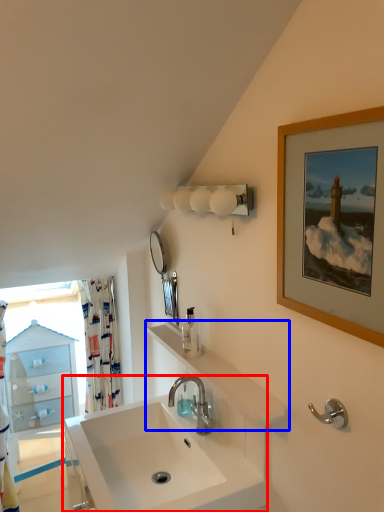
Question: Which object appears farthest to the camera in this image, sink (highlighted by a red box) or counter top (highlighted by a blue box)?

Choices:
 (A) sink
 (B) counter top

Answer: (B)